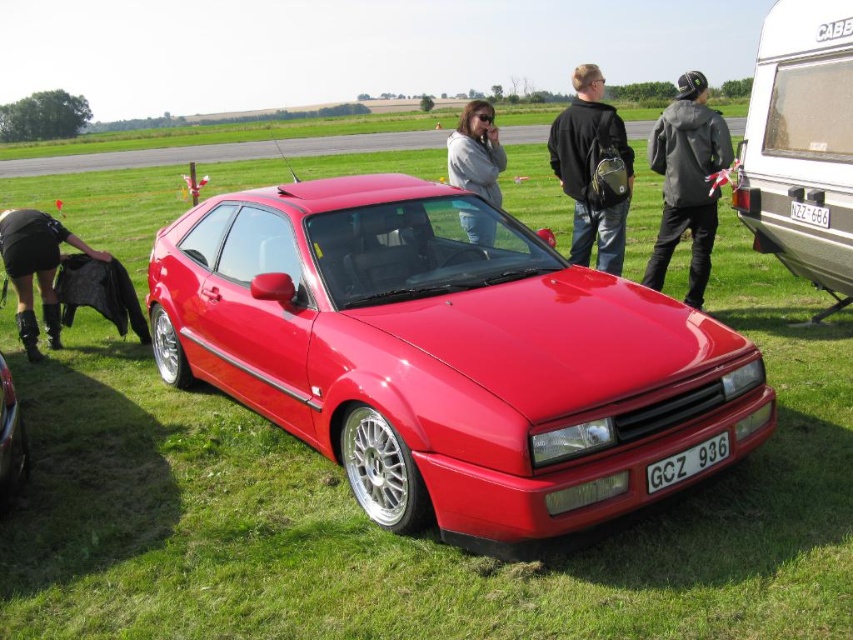
Can you confirm if black leather jacket at center is positioned to the left of black leather jacket at lower left?

No, black leather jacket at center is not to the left of black leather jacket at lower left.

Does point (614, 192) lie in front of point (33, 323)?

Yes, point (614, 192) is closer to viewer.

Locate an element on the screen. This screenshot has width=853, height=640. black leather jacket at center is located at coordinates (589, 170).

How far apart are shiny red car at center and black leather jacket at center?

shiny red car at center is 3.40 meters away from black leather jacket at center.

Does shiny red car at center appear over black leather jacket at center?

Actually, shiny red car at center is below black leather jacket at center.

This screenshot has width=853, height=640. Identify the location of shiny red car at center. (444, 355).

Is the position of black leather jacket at center more distant than that of shiny metallic car at center?

That is True.

Who is taller, black leather jacket at center or shiny metallic car at center?

shiny metallic car at center

Is point (582, 195) positioned behind point (16, 464)?

That is True.

This screenshot has height=640, width=853. I want to click on black leather jacket at center, so click(x=589, y=170).